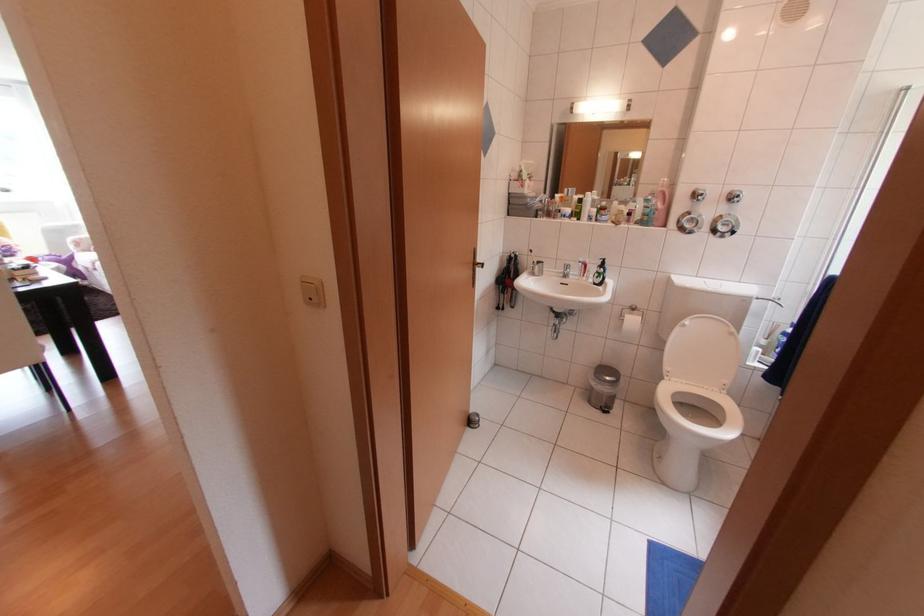
Where would you lift the metal door stop? Please return your answer as a coordinate pair (x, y).

(472, 419)